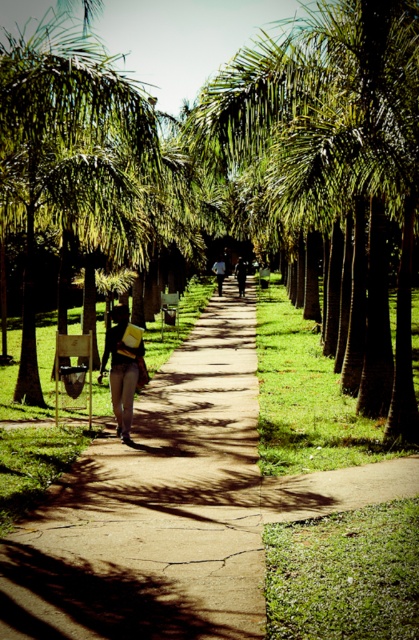
Consider the image. Between green leafy palm at center and light brown leather jacket at center, which one is positioned lower?

light brown leather jacket at center is lower down.

Which is in front, point (100, 45) or point (220, 289)?

Point (220, 289) is in front.

Between point (326, 204) and point (220, 276), which one is positioned behind?

The point (220, 276) is behind.

You are a GUI agent. You are given a task and a screenshot of the screen. Output one action in this format:
    pyautogui.click(x=<x>, y=<y>)
    Task: Click on the green leafy palm at center
    This screenshot has height=640, width=419.
    Given the screenshot: What is the action you would take?
    pyautogui.click(x=237, y=170)

Can you confirm if green leafy palm at center is thinner than matte yellow book at center?

No, green leafy palm at center is not thinner than matte yellow book at center.

Does green leafy palm at center lie in front of matte yellow book at center?

Yes.

Is point (328, 22) positioned in front of point (116, 358)?

No, it is behind (116, 358).

Locate an element on the screen. The height and width of the screenshot is (640, 419). green leafy palm at center is located at coordinates (237, 170).

Who is taller, green leafy palm at center or dark brown leather jacket at center?

Standing taller between the two is green leafy palm at center.

Between point (256, 84) and point (238, 262), which one is positioned behind?

Positioned behind is point (238, 262).

Does point (398, 116) lie in front of point (235, 268)?

Yes, it is in front of point (235, 268).

You are a GUI agent. You are given a task and a screenshot of the screen. Output one action in this format:
    pyautogui.click(x=<x>, y=<y>)
    Task: Click on the green leafy palm at center
    This screenshot has height=640, width=419.
    Given the screenshot: What is the action you would take?
    pyautogui.click(x=237, y=170)